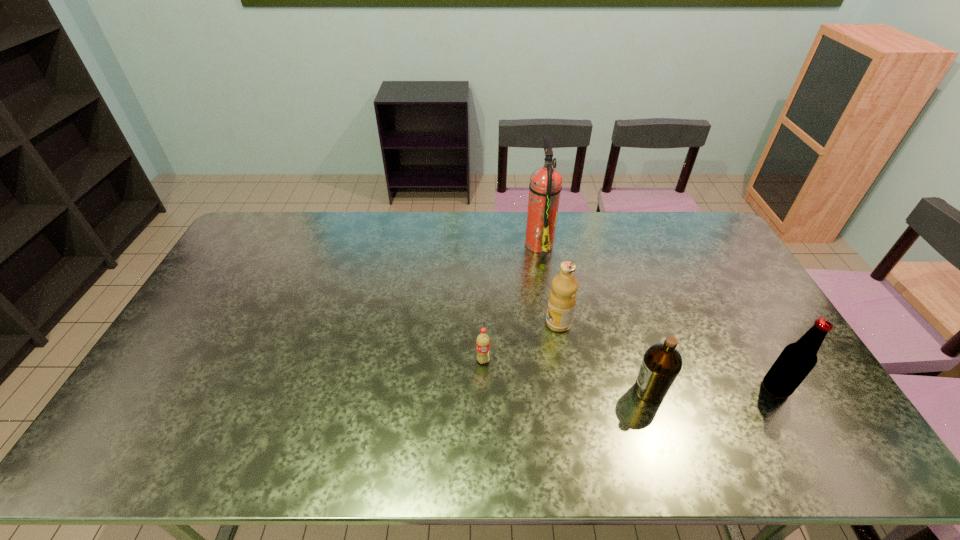
At what (x,y) coordinates should I click in order to perform the action: click on the tallest object. Please return your answer as a coordinate pair (x, y). The width and height of the screenshot is (960, 540). Looking at the image, I should click on (545, 186).

What are the coordinates of `the farthest object` in the screenshot? It's located at (545, 186).

Identify the location of the rightmost object. This screenshot has width=960, height=540. (796, 361).

Locate an element on the screen. Image resolution: width=960 pixels, height=540 pixels. the second farthest object is located at coordinates (562, 299).

Where is `the left olive oil`? This screenshot has height=540, width=960. the left olive oil is located at coordinates (562, 299).

At what (x,y) coordinates should I click in order to perform the action: click on the right olive oil. Please return your answer as a coordinate pair (x, y). The height and width of the screenshot is (540, 960). Looking at the image, I should click on (661, 364).

Where is `the second object from right to left`? This screenshot has width=960, height=540. the second object from right to left is located at coordinates (661, 364).

The width and height of the screenshot is (960, 540). Identify the location of the shortest object. (483, 340).

Locate an element on the screen. The image size is (960, 540). the leftmost object is located at coordinates (483, 340).

The width and height of the screenshot is (960, 540). What are the coordinates of `vacant space located at the nozzle of the farthest object` in the screenshot? It's located at (457, 243).